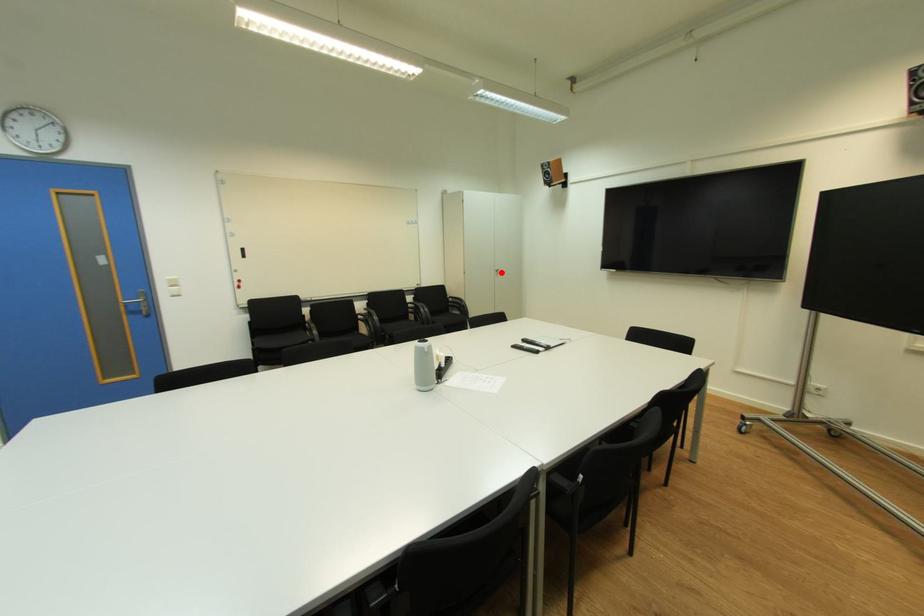
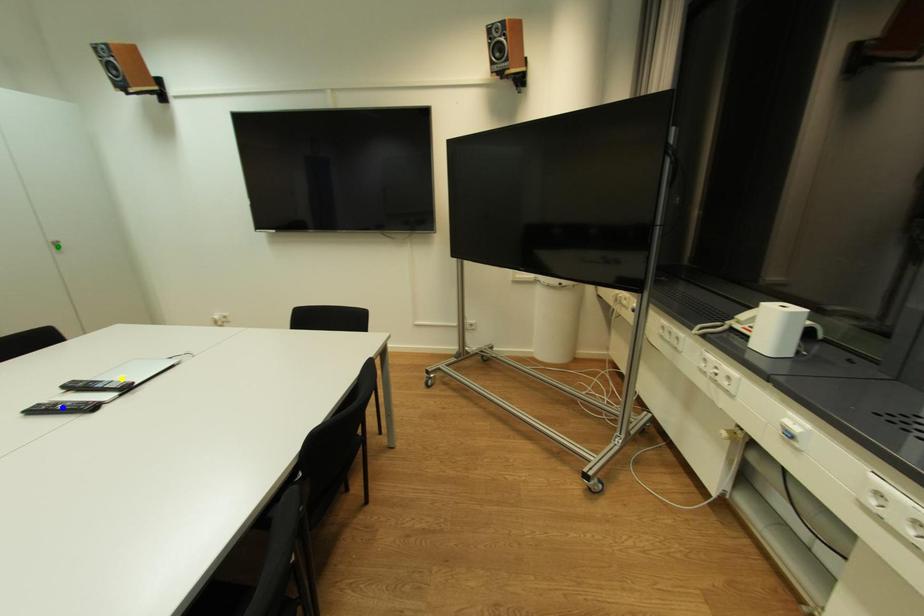
Question: I am providing you with two images of the same scene from different viewpoints. A red point is marked on the first image. You are given multiple points on the second image. Can you choose the point in image 2 that corresponds to the point in image 1?

Choices:
 (A) blue point
 (B) green point
 (C) yellow point

Answer: (B)